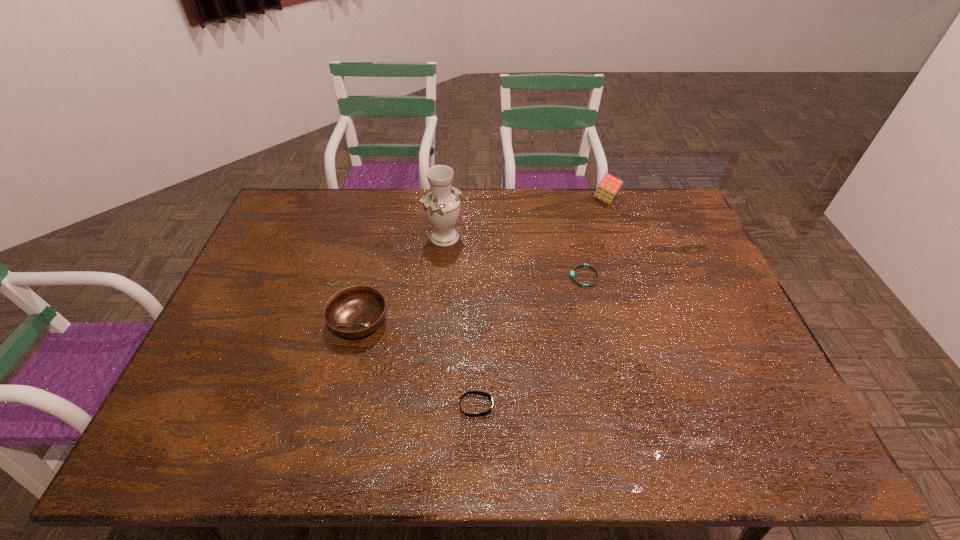
I want to click on free spot located 0.180m on the back of the fourth object from right to left, so click(x=448, y=194).

At what (x,y) coordinates should I click in order to perform the action: click on free space located on the right of the farthest object. Please return your answer as a coordinate pair (x, y). The width and height of the screenshot is (960, 540). Looking at the image, I should click on (672, 199).

Identify the location of blank space located 0.280m on the right of the fourth farthest object. (488, 321).

Identify the location of vacant space located 0.380m on the display of the fourth tallest object. (651, 406).

The height and width of the screenshot is (540, 960). Find the location of `vacant space located on the buckle of the shorter wristband`. vacant space located on the buckle of the shorter wristband is located at coordinates (444, 276).

Where is `vacant space located on the buckle of the shorter wristband`? vacant space located on the buckle of the shorter wristband is located at coordinates (441, 276).

At what (x,y) coordinates should I click in order to perform the action: click on free spot located 0.240m on the buckle of the shorter wristband. Please return your answer as a coordinate pair (x, y). Looking at the image, I should click on (492, 276).

Identify the location of vase that is at the far edge. The height and width of the screenshot is (540, 960). (442, 205).

Locate an element on the screen. cube that is at the far edge is located at coordinates (609, 186).

The width and height of the screenshot is (960, 540). What are the coordinates of `free space at the far edge of the desktop` in the screenshot? It's located at (346, 204).